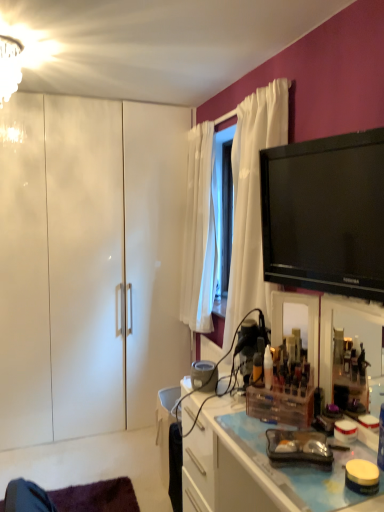
Locate an element on the screen. The image size is (384, 512). white glass chandelier at upper left is located at coordinates (9, 67).

Measure the distance between point (310, 505) and camera.

Point (310, 505) and camera are 3.74 feet apart.

The height and width of the screenshot is (512, 384). I want to click on clear plastic organizer at center, marked as the 2th cabinetry in a left-to-right arrangement, so click(255, 469).

What is the approximate height of black glossy tv at upper right?

black glossy tv at upper right is 19.67 inches tall.

Identify the location of white glass chandelier at upper left. This screenshot has width=384, height=512. (9, 67).

Does point (328, 195) lie in front of point (161, 230)?

Yes, point (328, 195) is in front of point (161, 230).

What's the angular difference between black glossy tv at upper right and white glossy cabinet at left, the 1th cabinetry when ordered from left to right,'s facing directions?

The angle between the facing direction of black glossy tv at upper right and the facing direction of white glossy cabinet at left, the 1th cabinetry when ordered from left to right, is 74.5 degrees.

Is black glossy tv at upper right not close to white glossy cabinet at left, acting as the 1th cabinetry starting from the back?

That's right, there is a large distance between black glossy tv at upper right and white glossy cabinet at left, acting as the 1th cabinetry starting from the back.

How much distance is there between black glossy tv at upper right and white glossy cabinet at left, the 2th cabinetry from the right?

black glossy tv at upper right and white glossy cabinet at left, the 2th cabinetry from the right, are 1.69 meters apart from each other.

How different are the orientations of black glossy tv at upper right and clear plastic organizer at center, marked as the 2th cabinetry in a left-to-right arrangement, in degrees?

The angle between the facing direction of black glossy tv at upper right and the facing direction of clear plastic organizer at center, marked as the 2th cabinetry in a left-to-right arrangement, is 15.1 degrees.

Is black glossy tv at upper right next to clear plastic organizer at center, which ranks as the 2th cabinetry in back-to-front order, and touching it?

No, black glossy tv at upper right is not in contact with clear plastic organizer at center, which ranks as the 2th cabinetry in back-to-front order.

Measure the distance from black glossy tv at upper right to clear plastic organizer at center, the first cabinetry when ordered from front to back.

black glossy tv at upper right is 29.00 inches away from clear plastic organizer at center, the first cabinetry when ordered from front to back.

Consider the image. From the image's perspective, who appears lower, black glossy tv at upper right or clear plastic organizer at center, the first cabinetry when ordered from front to back?

clear plastic organizer at center, the first cabinetry when ordered from front to back.

Is white glossy cabinet at left, the 1th cabinetry when ordered from left to right, facing towards white glass chandelier at upper left?

Yes, white glossy cabinet at left, the 1th cabinetry when ordered from left to right, faces towards white glass chandelier at upper left.

Is white glossy cabinet at left, the 2th cabinetry from the right, in contact with white glass chandelier at upper left?

white glossy cabinet at left, the 2th cabinetry from the right, is not next to white glass chandelier at upper left, and they're not touching.

Can you confirm if white glossy cabinet at left, acting as the 1th cabinetry starting from the back, is thinner than white glass chandelier at upper left?

Incorrect, the width of white glossy cabinet at left, acting as the 1th cabinetry starting from the back, is not less than that of white glass chandelier at upper left.

Who is shorter, clear plastic organizer at center, marked as the 2th cabinetry in a left-to-right arrangement, or white glass chandelier at upper left?

With less height is white glass chandelier at upper left.

In the image, is clear plastic organizer at center, marked as the 2th cabinetry in a left-to-right arrangement, on the left side or the right side of white glass chandelier at upper left?

clear plastic organizer at center, marked as the 2th cabinetry in a left-to-right arrangement, is positioned on white glass chandelier at upper left's right side.

Which is in front, point (210, 456) or point (6, 87)?

Point (210, 456)

Would you say clear plastic organizer at center, which ranks as the 2th cabinetry in back-to-front order, contains white glass chandelier at upper left?

No, white glass chandelier at upper left is located outside of clear plastic organizer at center, which ranks as the 2th cabinetry in back-to-front order.

Is black glossy tv at upper right positioned with its back to white glass chandelier at upper left?

No, black glossy tv at upper right's orientation is not away from white glass chandelier at upper left.

Is black glossy tv at upper right placed right next to white glass chandelier at upper left?

No, black glossy tv at upper right is not in contact with white glass chandelier at upper left.

From a real-world perspective, is black glossy tv at upper right beneath white glass chandelier at upper left?

Yes, from a real-world perspective, black glossy tv at upper right is below white glass chandelier at upper left.

Between black glossy tv at upper right and white glass chandelier at upper left, which one appears on the right side from the viewer's perspective?

black glossy tv at upper right is more to the right.

From the image's perspective, starting from the black glossy tv at upper right, which cabinetry is the 1st one below? Please provide its 2D coordinates.

[(89, 264)]

Does white glossy cabinet at left, the second cabinetry from the front, have a larger size compared to black glossy tv at upper right?

Yes.

From a real-world perspective, relative to black glossy tv at upper right, is white glossy cabinet at left, the 1th cabinetry when ordered from left to right, vertically above or below?

Clearly, from a real-world perspective, white glossy cabinet at left, the 1th cabinetry when ordered from left to right, is below black glossy tv at upper right.

Which point is more forward, (19, 151) or (313, 182)?

The point (313, 182) is in front.

Is clear plastic organizer at center, marked as the 2th cabinetry in a left-to-right arrangement, beside white glossy cabinet at left, the 1th cabinetry when ordered from left to right?

clear plastic organizer at center, marked as the 2th cabinetry in a left-to-right arrangement, and white glossy cabinet at left, the 1th cabinetry when ordered from left to right, are not in contact.

Is clear plastic organizer at center, which is the 1th cabinetry from right to left, to the right of white glossy cabinet at left, the 2th cabinetry from the right, from the viewer's perspective?

Correct, you'll find clear plastic organizer at center, which is the 1th cabinetry from right to left, to the right of white glossy cabinet at left, the 2th cabinetry from the right.

From the image's perspective, is clear plastic organizer at center, marked as the 2th cabinetry in a left-to-right arrangement, located beneath white glossy cabinet at left, the second cabinetry from the front?

Yes, from the image's perspective, clear plastic organizer at center, marked as the 2th cabinetry in a left-to-right arrangement, is beneath white glossy cabinet at left, the second cabinetry from the front.

From a real-world perspective, who is located higher, clear plastic organizer at center, marked as the 2th cabinetry in a left-to-right arrangement, or white glossy cabinet at left, the second cabinetry from the front?

white glossy cabinet at left, the second cabinetry from the front, from a real-world perspective.

Where is `television in front of the white glossy cabinet at left, the 1th cabinetry when ordered from left to right`? television in front of the white glossy cabinet at left, the 1th cabinetry when ordered from left to right is located at coordinates (325, 214).

I want to click on television that appears behind the clear plastic organizer at center, marked as the 2th cabinetry in a left-to-right arrangement, so 325,214.

Which object lies further to the anchor point white glossy cabinet at left, acting as the 1th cabinetry starting from the back, clear plastic organizer at center, which is the 1th cabinetry from right to left, or black glossy tv at upper right?

The object further to white glossy cabinet at left, acting as the 1th cabinetry starting from the back, is black glossy tv at upper right.

Considering their positions, is white glossy cabinet at left, the 2th cabinetry from the right, positioned further to white glass chandelier at upper left than black glossy tv at upper right?

black glossy tv at upper right is further to white glass chandelier at upper left.

When comparing their distances from clear plastic organizer at center, marked as the 2th cabinetry in a left-to-right arrangement, does white glossy cabinet at left, the 2th cabinetry from the right, or white glass chandelier at upper left seem further?

Among the two, white glass chandelier at upper left is located further to clear plastic organizer at center, marked as the 2th cabinetry in a left-to-right arrangement.

Based on their spatial positions, is black glossy tv at upper right or white glossy cabinet at left, the 1th cabinetry when ordered from left to right, closer to clear plastic organizer at center, marked as the 2th cabinetry in a left-to-right arrangement?

black glossy tv at upper right is positioned closer to the anchor clear plastic organizer at center, marked as the 2th cabinetry in a left-to-right arrangement.

Looking at this image, looking at the image, which one is located further to clear plastic organizer at center, which ranks as the 2th cabinetry in back-to-front order, white glass chandelier at upper left or black glossy tv at upper right?

Based on the image, white glass chandelier at upper left appears to be further to clear plastic organizer at center, which ranks as the 2th cabinetry in back-to-front order.

When comparing their distances from white glossy cabinet at left, the 1th cabinetry when ordered from left to right, does white glass chandelier at upper left or black glossy tv at upper right seem closer?

white glass chandelier at upper left.

Considering their positions, is white glass chandelier at upper left positioned further to clear plastic organizer at center, the first cabinetry when ordered from front to back, than white glossy cabinet at left, acting as the 1th cabinetry starting from the back?

white glass chandelier at upper left lies further to clear plastic organizer at center, the first cabinetry when ordered from front to back, than the other object.

Estimate the real-world distances between objects in this image. Which object is further from clear plastic organizer at center, marked as the 2th cabinetry in a left-to-right arrangement, white glossy cabinet at left, acting as the 1th cabinetry starting from the back, or black glossy tv at upper right?

Among the two, white glossy cabinet at left, acting as the 1th cabinetry starting from the back, is located further to clear plastic organizer at center, marked as the 2th cabinetry in a left-to-right arrangement.

Where is `television between white glass chandelier at upper left and clear plastic organizer at center, marked as the 2th cabinetry in a left-to-right arrangement, in the vertical direction`? The image size is (384, 512). television between white glass chandelier at upper left and clear plastic organizer at center, marked as the 2th cabinetry in a left-to-right arrangement, in the vertical direction is located at coordinates (325, 214).

Where is `television located between clear plastic organizer at center, which is the 1th cabinetry from right to left, and white glossy cabinet at left, the second cabinetry from the front, in the depth direction`? television located between clear plastic organizer at center, which is the 1th cabinetry from right to left, and white glossy cabinet at left, the second cabinetry from the front, in the depth direction is located at coordinates (325, 214).

Image resolution: width=384 pixels, height=512 pixels. In order to click on cabinetry between white glass chandelier at upper left and clear plastic organizer at center, which is the 1th cabinetry from right to left, vertically in this screenshot , I will do `click(89, 264)`.